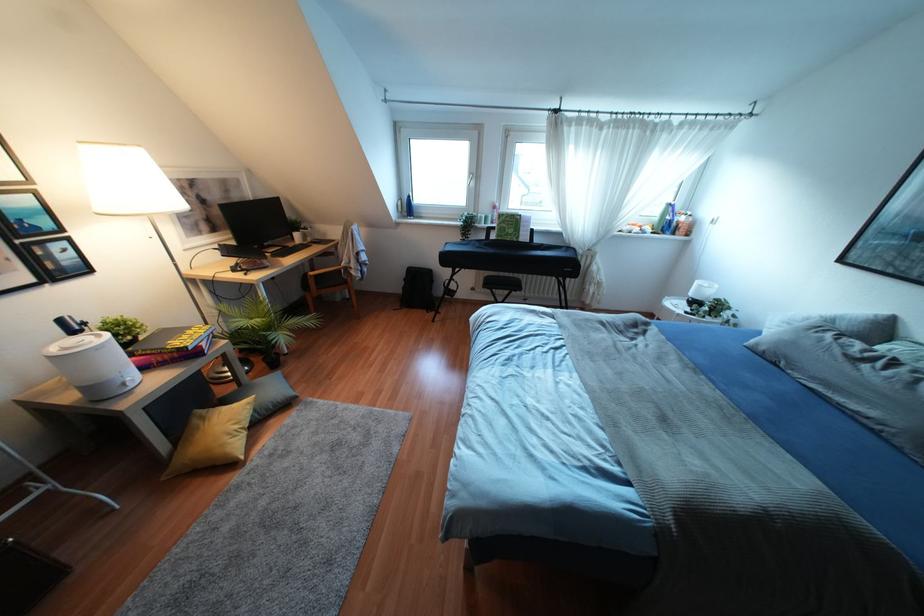
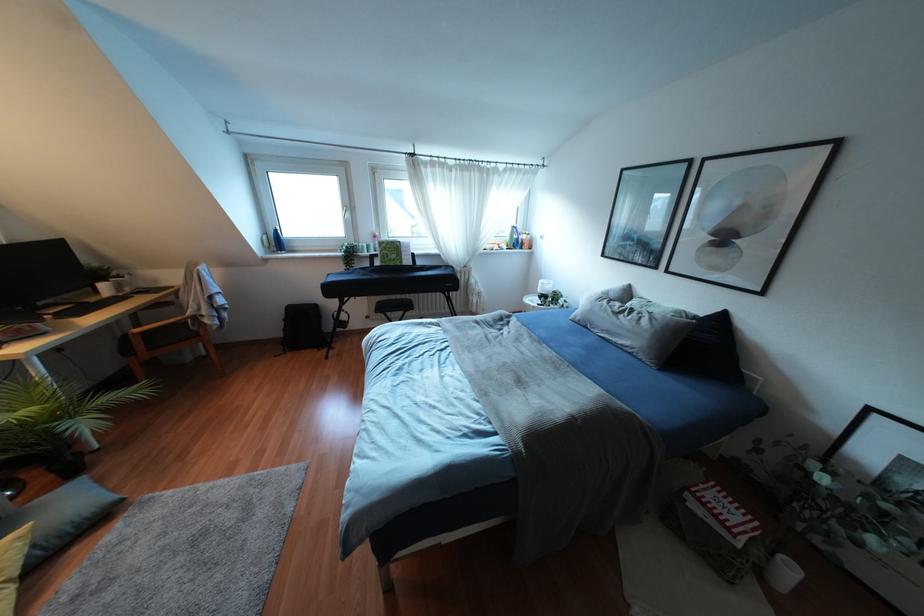
The point at (345,282) is marked in the first image. Where is the corresponding point in the second image?

(196, 334)